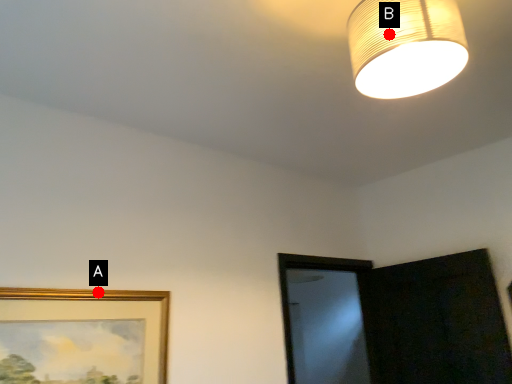
Question: Two points are circled on the image, labeled by A and B beside each circle. Which point appears closest to the camera in this image?

Choices:
 (A) A is closer
 (B) B is closer

Answer: (B)